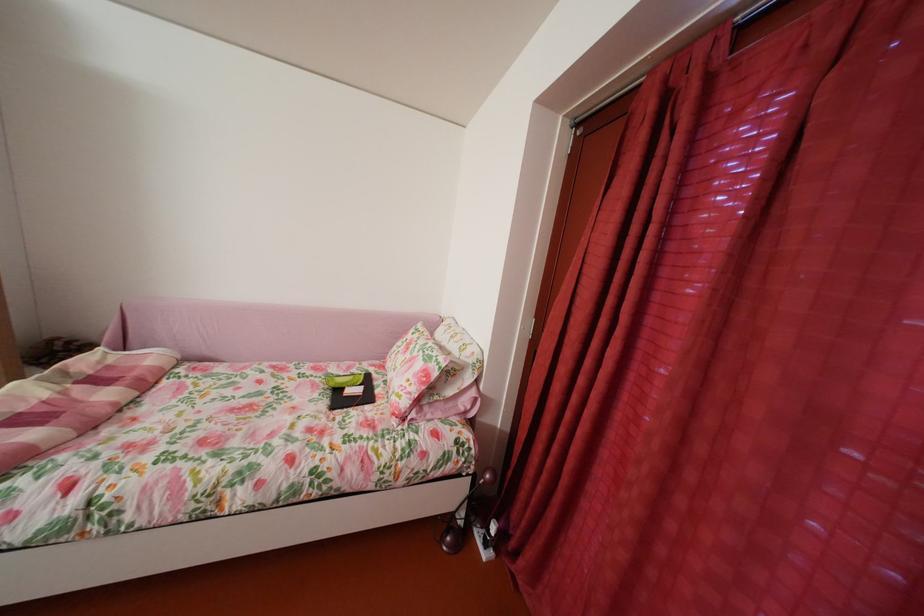
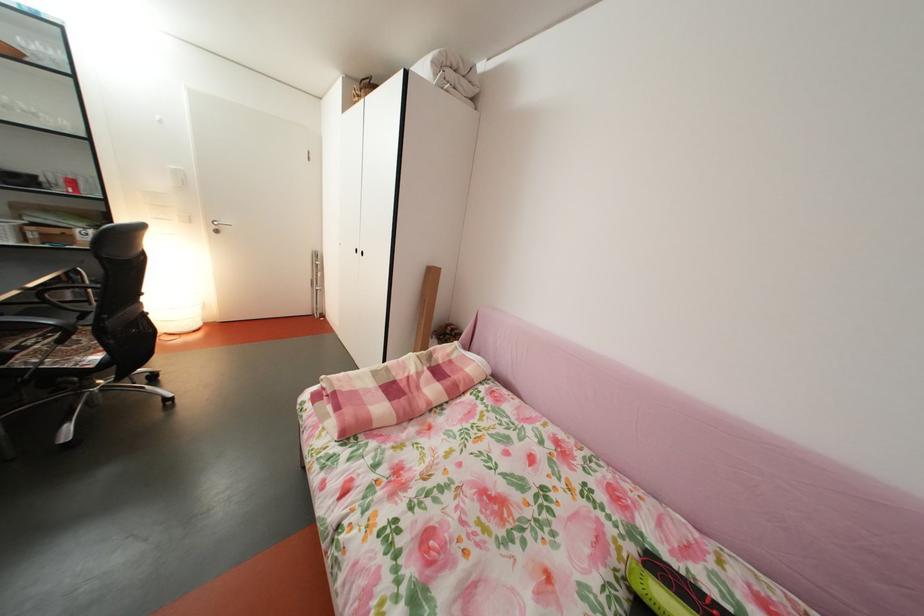
Question: How did the camera likely rotate?

Choices:
 (A) Left
 (B) Right
 (C) Up
 (D) Down

Answer: (A)